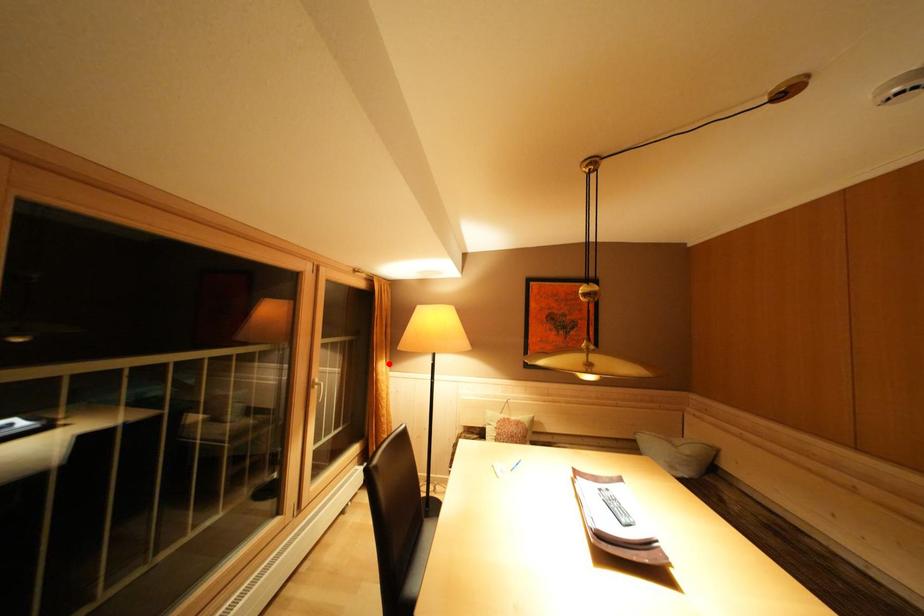
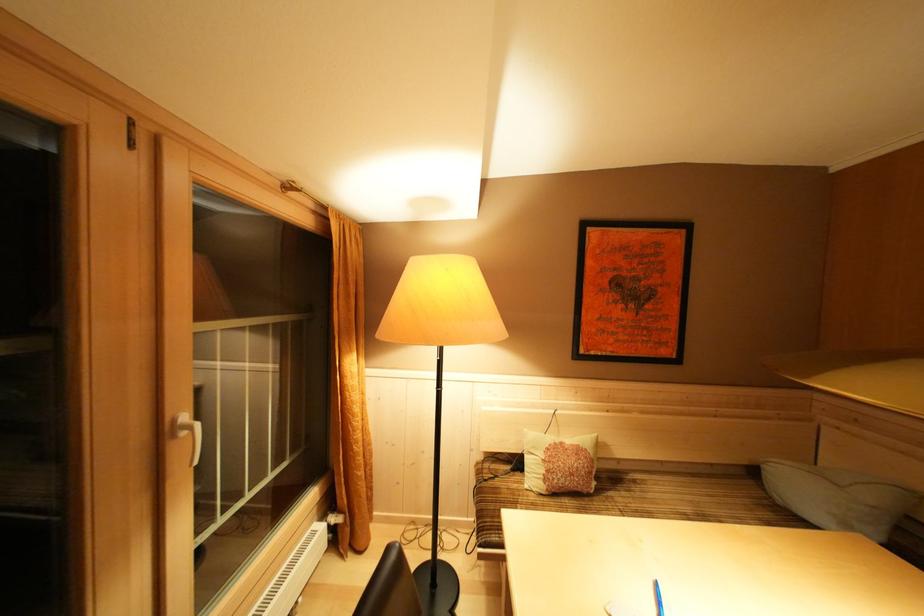
Locate, in the second image, the point that corresponds to the highlighted location in the first image.

(358, 357)